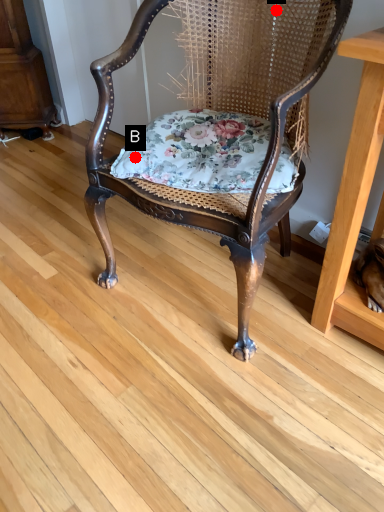
Question: Two points are circled on the image, labeled by A and B beside each circle. Which point appears closest to the camera in this image?

Choices:
 (A) A is closer
 (B) B is closer

Answer: (B)